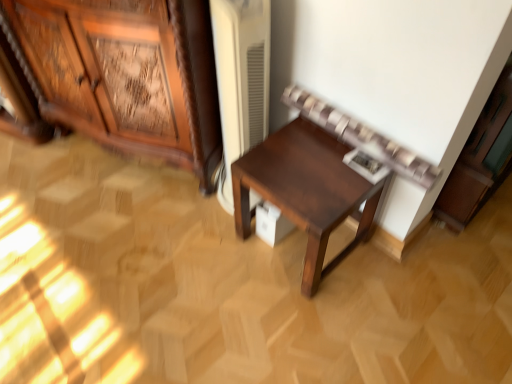
Locate an element on the screen. wooden carved cabinet at left, the first cabinetry viewed from the left is located at coordinates (124, 74).

Describe the element at coordinates (305, 190) in the screenshot. This screenshot has height=384, width=512. I see `dark wood table at center` at that location.

This screenshot has height=384, width=512. I want to click on white matte cabinet at upper right, placed as the 2th cabinetry when sorted from left to right, so click(x=480, y=158).

Is white matte cabinet at upper right, placed as the 2th cabinetry when sorted from left to right, beside dark wood table at center?

No, white matte cabinet at upper right, placed as the 2th cabinetry when sorted from left to right, is not beside dark wood table at center.

Would you say dark wood table at center is part of white matte cabinet at upper right, placed as the 2th cabinetry when sorted from left to right,'s contents?

No, dark wood table at center is located outside of white matte cabinet at upper right, placed as the 2th cabinetry when sorted from left to right.

From the picture: Considering the sizes of objects white matte cabinet at upper right, arranged as the 1th cabinetry when viewed from the right, and dark wood table at center in the image provided, who is smaller, white matte cabinet at upper right, arranged as the 1th cabinetry when viewed from the right, or dark wood table at center?

With smaller size is dark wood table at center.

What's the angular difference between white matte cabinet at upper right, placed as the 2th cabinetry when sorted from left to right, and dark wood table at center's facing directions?

90.2 degrees separate the facing orientations of white matte cabinet at upper right, placed as the 2th cabinetry when sorted from left to right, and dark wood table at center.

Is wooden carved cabinet at left, the first cabinetry viewed from the left, positioned with its back to dark wood table at center?

That's not correct — wooden carved cabinet at left, the first cabinetry viewed from the left, is not looking away from dark wood table at center.

Where is `cabinetry that is the 2nd one above the dark wood table at center (from a real-world perspective)`? The image size is (512, 384). cabinetry that is the 2nd one above the dark wood table at center (from a real-world perspective) is located at coordinates (124, 74).

Considering the sizes of objects wooden carved cabinet at left, the first cabinetry viewed from the left, and dark wood table at center in the image provided, who is taller, wooden carved cabinet at left, the first cabinetry viewed from the left, or dark wood table at center?

Standing taller between the two is wooden carved cabinet at left, the first cabinetry viewed from the left.

Does wooden carved cabinet at left, the first cabinetry viewed from the left, have a larger size compared to dark wood table at center?

Indeed, wooden carved cabinet at left, the first cabinetry viewed from the left, has a larger size compared to dark wood table at center.

Considering the positions of objects dark wood table at center and white matte cabinet at upper right, arranged as the 1th cabinetry when viewed from the right, in the image provided, who is behind, dark wood table at center or white matte cabinet at upper right, arranged as the 1th cabinetry when viewed from the right,?

dark wood table at center is behind.

Which of these two, dark wood table at center or white matte cabinet at upper right, arranged as the 1th cabinetry when viewed from the right, stands taller?

white matte cabinet at upper right, arranged as the 1th cabinetry when viewed from the right.

From a real-world perspective, which cabinetry is the 1st one above the dark wood table at center? Please provide its 2D coordinates.

[(480, 158)]

Does dark wood table at center have a lesser width compared to white matte cabinet at upper right, placed as the 2th cabinetry when sorted from left to right?

No.

Based on the photo, considering the relative sizes of dark wood table at center and wooden carved cabinet at left, the first cabinetry viewed from the left, in the image provided, is dark wood table at center thinner than wooden carved cabinet at left, the first cabinetry viewed from the left,?

Indeed, dark wood table at center has a lesser width compared to wooden carved cabinet at left, the first cabinetry viewed from the left.

Is dark wood table at center taller than wooden carved cabinet at left, the first cabinetry viewed from the left?

No.

Can you tell me how much dark wood table at center and wooden carved cabinet at left, the first cabinetry viewed from the left, differ in facing direction?

The angle between the facing direction of dark wood table at center and the facing direction of wooden carved cabinet at left, the first cabinetry viewed from the left, is 20.1 degrees.

From the image's perspective, is dark wood table at center beneath wooden carved cabinet at left, which is counted as the 2th cabinetry, starting from the right?

Yes, from the image's perspective, dark wood table at center is below wooden carved cabinet at left, which is counted as the 2th cabinetry, starting from the right.

This screenshot has height=384, width=512. What are the coordinates of `cabinetry that is above the white matte cabinet at upper right, arranged as the 1th cabinetry when viewed from the right (from the image's perspective)` in the screenshot? It's located at (124, 74).

Would you consider wooden carved cabinet at left, the first cabinetry viewed from the left, to be distant from white matte cabinet at upper right, placed as the 2th cabinetry when sorted from left to right?

Actually, wooden carved cabinet at left, the first cabinetry viewed from the left, and white matte cabinet at upper right, placed as the 2th cabinetry when sorted from left to right, are a little close together.

From the image's perspective, is wooden carved cabinet at left, which is counted as the 2th cabinetry, starting from the right, below white matte cabinet at upper right, placed as the 2th cabinetry when sorted from left to right?

No, from the image's perspective, wooden carved cabinet at left, which is counted as the 2th cabinetry, starting from the right, is not beneath white matte cabinet at upper right, placed as the 2th cabinetry when sorted from left to right.

In the scene shown: Which of these two, wooden carved cabinet at left, the first cabinetry viewed from the left, or white matte cabinet at upper right, arranged as the 1th cabinetry when viewed from the right, stands taller?

wooden carved cabinet at left, the first cabinetry viewed from the left.

From the image's perspective, who appears lower, white matte cabinet at upper right, placed as the 2th cabinetry when sorted from left to right, or wooden carved cabinet at left, the first cabinetry viewed from the left?

white matte cabinet at upper right, placed as the 2th cabinetry when sorted from left to right.

Is white matte cabinet at upper right, placed as the 2th cabinetry when sorted from left to right, not inside wooden carved cabinet at left, which is counted as the 2th cabinetry, starting from the right?

That's correct, white matte cabinet at upper right, placed as the 2th cabinetry when sorted from left to right, is outside of wooden carved cabinet at left, which is counted as the 2th cabinetry, starting from the right.

Is the depth of white matte cabinet at upper right, placed as the 2th cabinetry when sorted from left to right, less than that of wooden carved cabinet at left, the first cabinetry viewed from the left?

Yes, it is in front of wooden carved cabinet at left, the first cabinetry viewed from the left.

Is white matte cabinet at upper right, arranged as the 1th cabinetry when viewed from the right, placed right next to wooden carved cabinet at left, which is counted as the 2th cabinetry, starting from the right?

white matte cabinet at upper right, arranged as the 1th cabinetry when viewed from the right, and wooden carved cabinet at left, which is counted as the 2th cabinetry, starting from the right, are not in contact.

Locate an element on the screen. The width and height of the screenshot is (512, 384). cabinetry located on the right of dark wood table at center is located at coordinates (480, 158).

The width and height of the screenshot is (512, 384). Find the location of `table below the wooden carved cabinet at left, the first cabinetry viewed from the left (from a real-world perspective)`. table below the wooden carved cabinet at left, the first cabinetry viewed from the left (from a real-world perspective) is located at coordinates (305, 190).

Which object lies further to the anchor point white matte cabinet at upper right, arranged as the 1th cabinetry when viewed from the right, wooden carved cabinet at left, which is counted as the 2th cabinetry, starting from the right, or dark wood table at center?

wooden carved cabinet at left, which is counted as the 2th cabinetry, starting from the right, is positioned further to the anchor white matte cabinet at upper right, arranged as the 1th cabinetry when viewed from the right.

Estimate the real-world distances between objects in this image. Which object is closer to white matte cabinet at upper right, arranged as the 1th cabinetry when viewed from the right, dark wood table at center or wooden carved cabinet at left, the first cabinetry viewed from the left?

The object closer to white matte cabinet at upper right, arranged as the 1th cabinetry when viewed from the right, is dark wood table at center.

When comparing their distances from wooden carved cabinet at left, which is counted as the 2th cabinetry, starting from the right, does dark wood table at center or white matte cabinet at upper right, placed as the 2th cabinetry when sorted from left to right, seem further?

Based on the image, white matte cabinet at upper right, placed as the 2th cabinetry when sorted from left to right, appears to be further to wooden carved cabinet at left, which is counted as the 2th cabinetry, starting from the right.

Looking at the image, which one is located further to dark wood table at center, wooden carved cabinet at left, the first cabinetry viewed from the left, or white matte cabinet at upper right, arranged as the 1th cabinetry when viewed from the right?

The object further to dark wood table at center is wooden carved cabinet at left, the first cabinetry viewed from the left.

From the image, which object appears to be nearer to dark wood table at center, white matte cabinet at upper right, placed as the 2th cabinetry when sorted from left to right, or wooden carved cabinet at left, the first cabinetry viewed from the left?

white matte cabinet at upper right, placed as the 2th cabinetry when sorted from left to right, is closer to dark wood table at center.

Looking at the image, which one is located closer to wooden carved cabinet at left, which is counted as the 2th cabinetry, starting from the right, white matte cabinet at upper right, placed as the 2th cabinetry when sorted from left to right, or dark wood table at center?

dark wood table at center is closer to wooden carved cabinet at left, which is counted as the 2th cabinetry, starting from the right.

The width and height of the screenshot is (512, 384). I want to click on table between wooden carved cabinet at left, the first cabinetry viewed from the left, and white matte cabinet at upper right, placed as the 2th cabinetry when sorted from left to right, from left to right, so click(x=305, y=190).